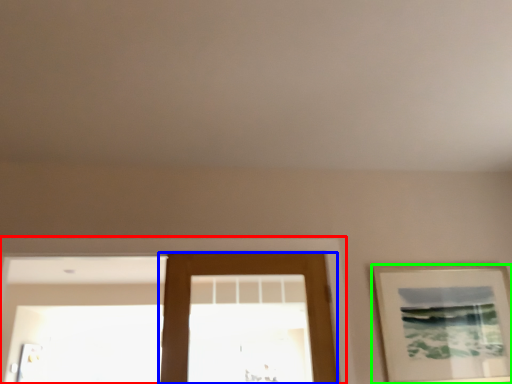
Question: Which object is positioned closest to window frame (highlighted by a red box)? Select from door (highlighted by a blue box) and picture frame (highlighted by a green box).

Choices:
 (A) door
 (B) picture frame

Answer: (A)